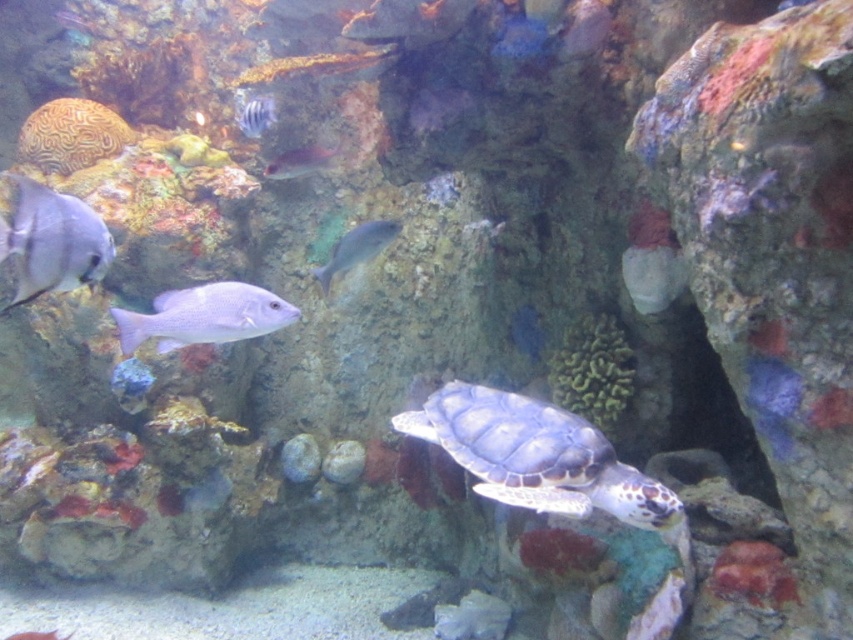
Question: Based on their relative distances, which object is nearer to the striped scales fish at upper left?

Choices:
 (A) translucent pinkish fish at upper center
 (B) leather-like greenish-brown turtle at center
 (C) satin silver fish at center

Answer: (A)

Question: Is silver metallic fish at left below purple matte fish at center?

Choices:
 (A) yes
 (B) no

Answer: (B)

Question: Can you confirm if shiny silver fish at upper center is positioned to the right of satin silver fish at center?

Choices:
 (A) yes
 (B) no

Answer: (B)

Question: Which object appears farthest from the camera in this image?

Choices:
 (A) leather-like greenish-brown turtle at center
 (B) striped scales fish at upper left

Answer: (B)

Question: Is shiny silver fish at upper center positioned behind shiny silver fish at lower left?

Choices:
 (A) yes
 (B) no

Answer: (B)

Question: Which point appears closest to the camera in this image?

Choices:
 (A) (294, 172)
 (B) (357, 256)
 (C) (543, 493)
 (D) (271, 120)

Answer: (C)